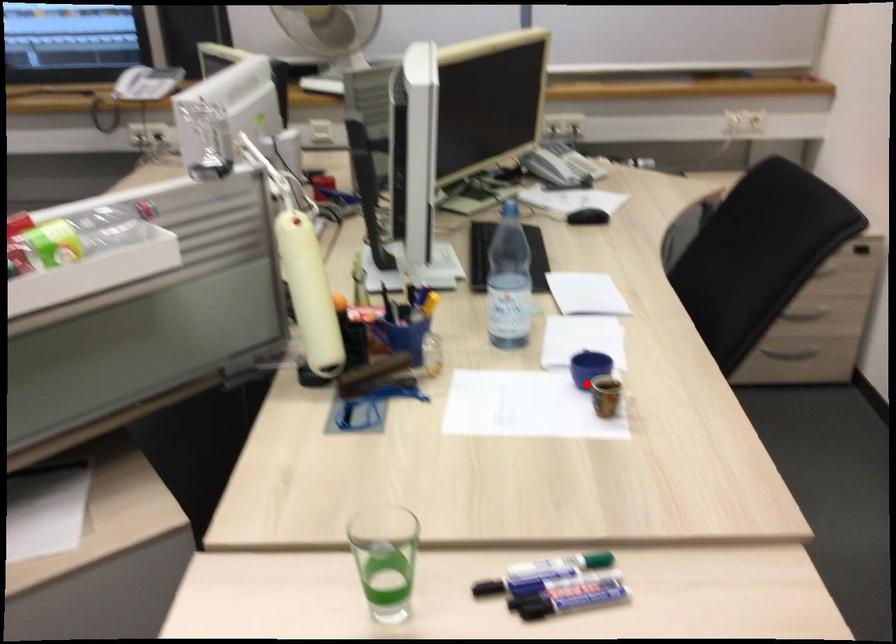
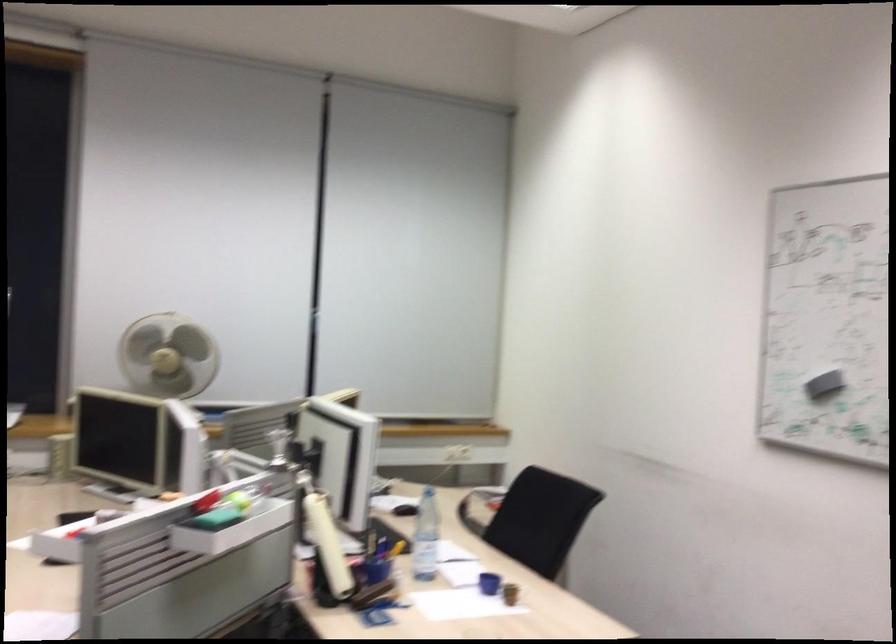
The point at the highlighted location is marked in the first image. Where is the corresponding point in the second image?

(488, 583)